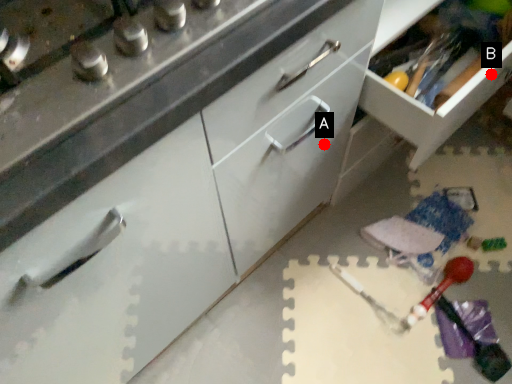
Question: Two points are circled on the image, labeled by A and B beside each circle. Which point is further to the camera?

Choices:
 (A) A is further
 (B) B is further

Answer: (A)